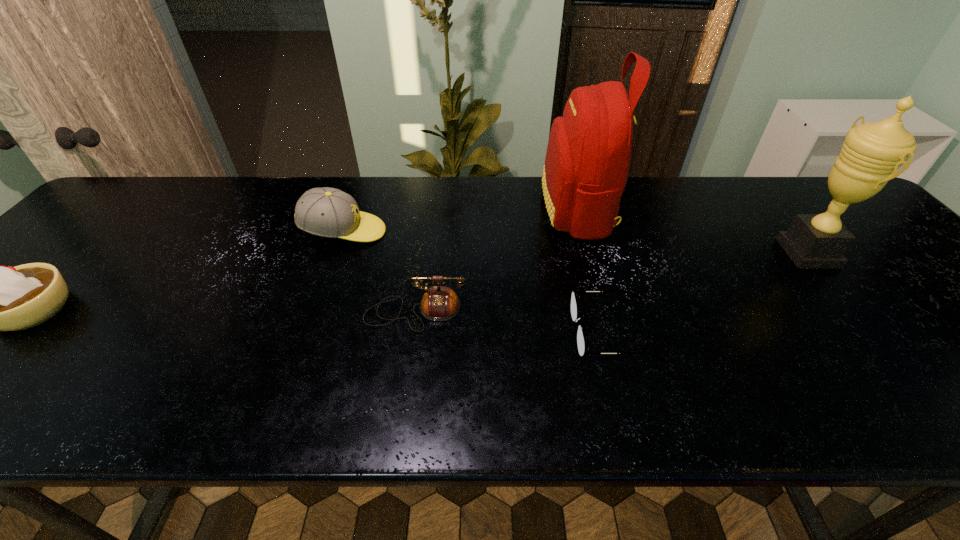
At what (x,y) coordinates should I click in order to perform the action: click on empty location between the baseball cap and the telephone. Please return your answer as a coordinate pair (x, y). The width and height of the screenshot is (960, 540). Looking at the image, I should click on coord(380,272).

Find the location of a particular element. free space between the telephone and the trophy cup is located at coordinates (612, 282).

At what (x,y) coordinates should I click in order to perform the action: click on vacant area between the backpack and the baseball cap. Please return your answer as a coordinate pair (x, y). Looking at the image, I should click on (461, 221).

Where is `vacant region between the trophy cup and the shortest object`? This screenshot has width=960, height=540. vacant region between the trophy cup and the shortest object is located at coordinates (710, 293).

Image resolution: width=960 pixels, height=540 pixels. I want to click on free space between the spectacles and the trophy cup, so click(x=710, y=293).

Identify which object is located as the third nearest to the whipped cream. Please provide its 2D coordinates. Your answer should be formatted as a tuple, i.e. [(x, y)], where the tuple contains the x and y coordinates of a point satisfying the conditions above.

[(587, 161)]

Select which object is the second closest to the telephone. Please provide its 2D coordinates. Your answer should be formatted as a tuple, i.e. [(x, y)], where the tuple contains the x and y coordinates of a point satisfying the conditions above.

[(574, 311)]

The height and width of the screenshot is (540, 960). Find the location of `vacant area that satisfies the following two spatial constraints: 1. at the front of the rightmost object with handles; 2. on the rotary dial of the telephone`. vacant area that satisfies the following two spatial constraints: 1. at the front of the rightmost object with handles; 2. on the rotary dial of the telephone is located at coordinates (854, 311).

I want to click on vacant space that satisfies the following two spatial constraints: 1. on the front-facing side of the backpack; 2. on the rotary dial of the fifth tallest object, so click(x=605, y=311).

The image size is (960, 540). In order to click on free spot that satisfies the following two spatial constraints: 1. at the front of the rightmost object with handles; 2. on the rotary dial of the second shortest object in this screenshot , I will do `click(854, 311)`.